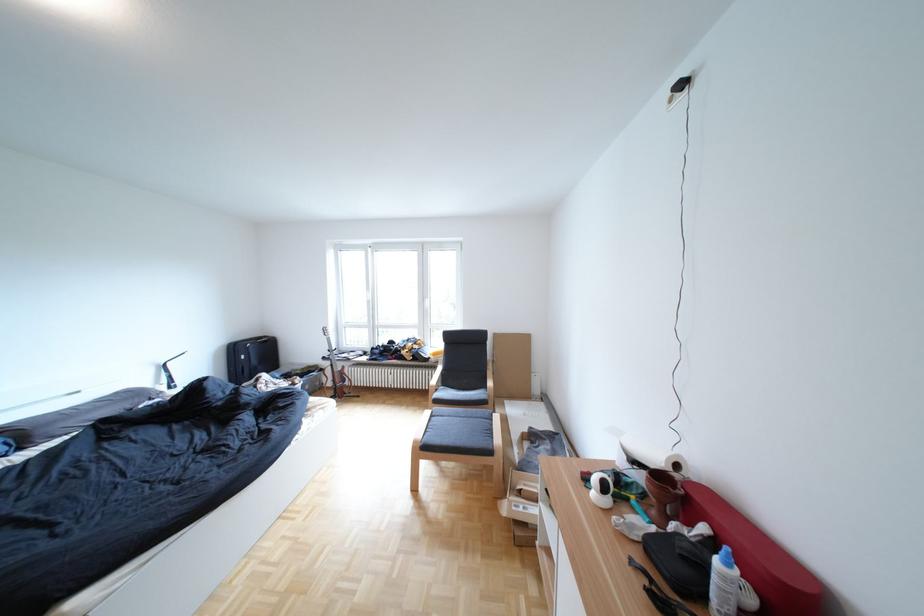
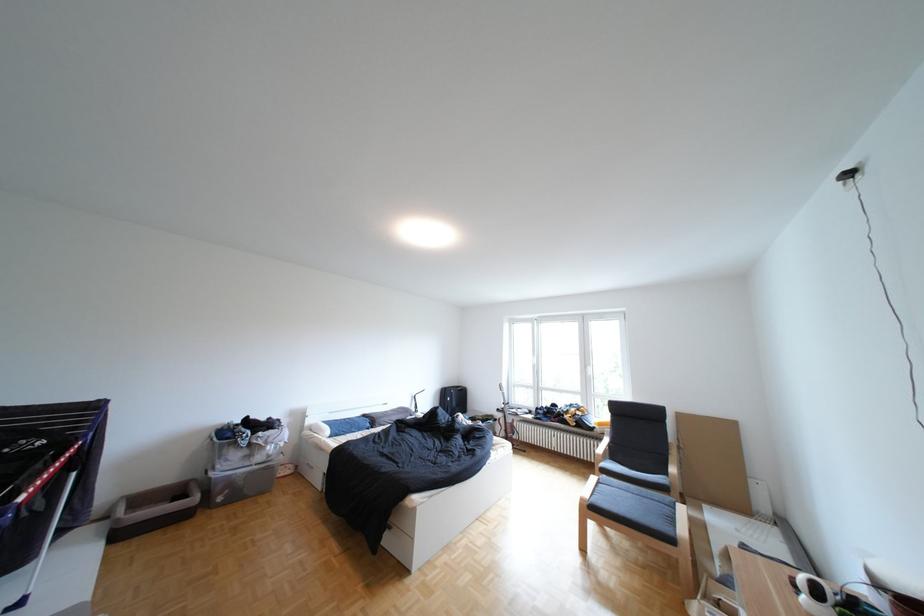
In the second image, find the point that corresponds to point 419,408 in the first image.

(584, 474)